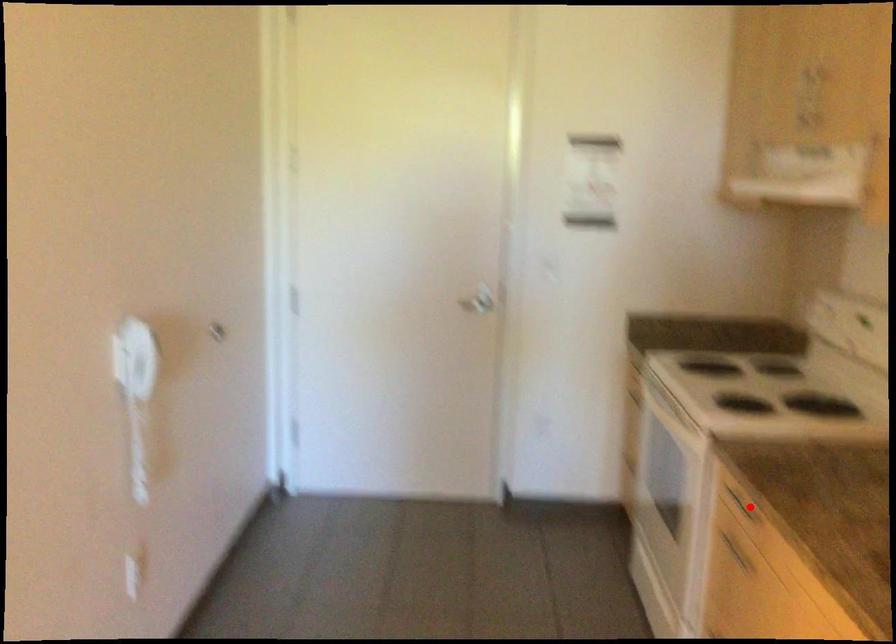
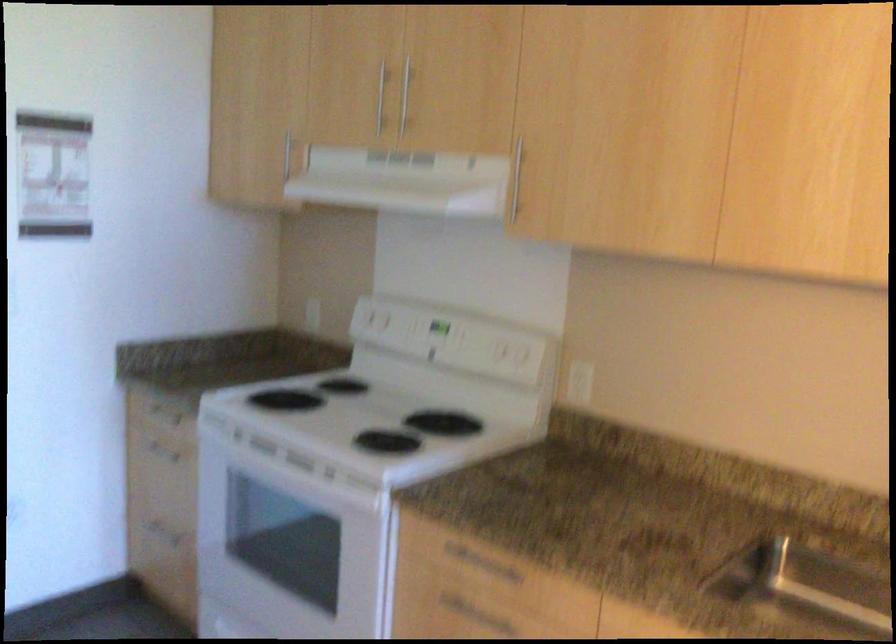
Locate, in the second image, the point that corresponds to the highlighted location in the first image.

(480, 564)